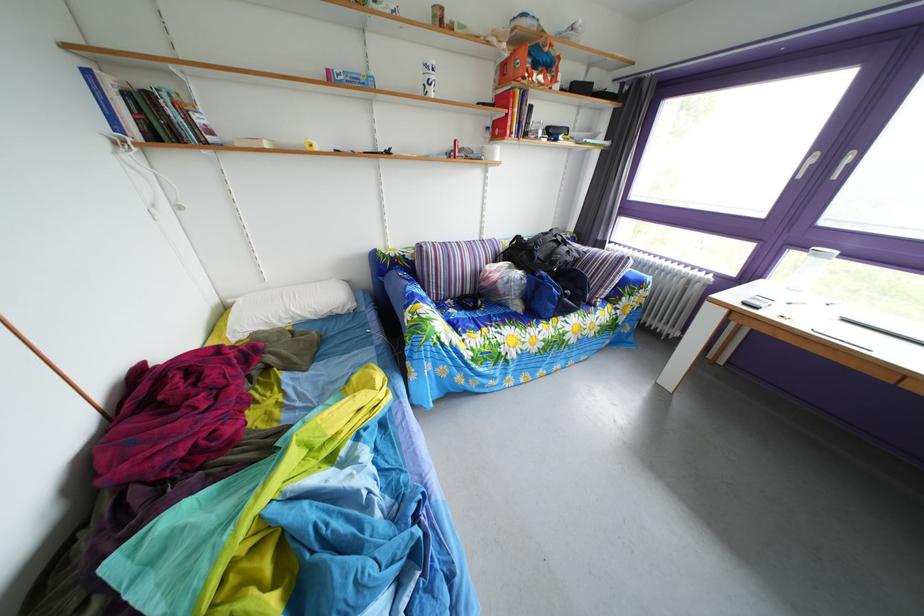
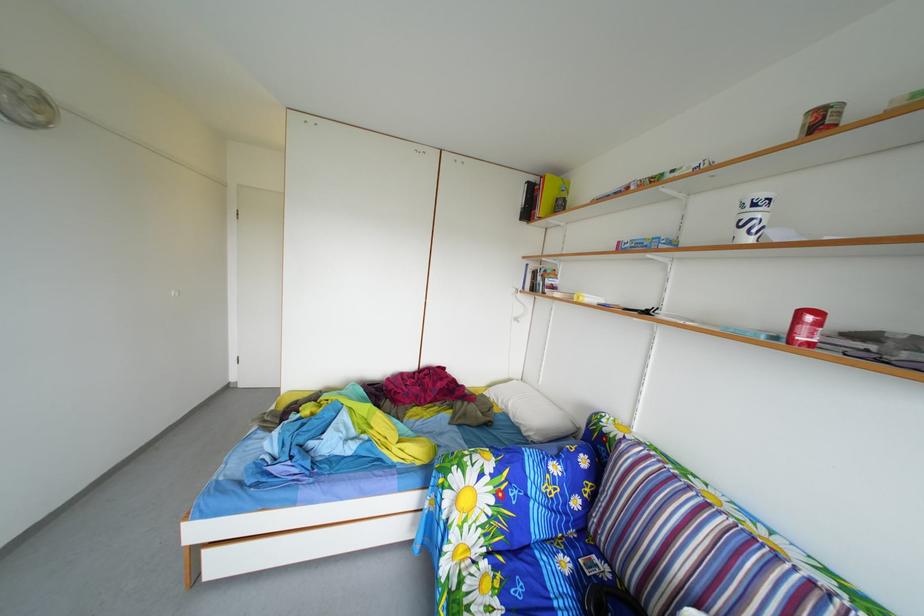
Where in the second image is the point corresponding to (x=466, y=150) from the first image?

(811, 321)